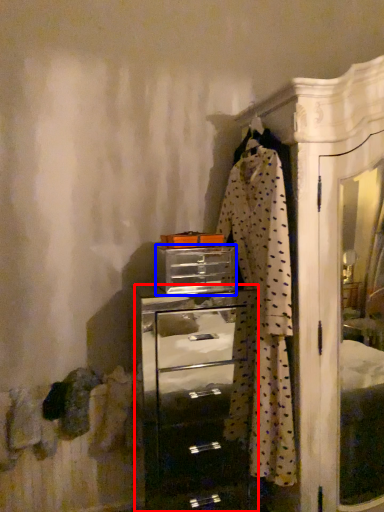
Question: Which of the following is the closest to the observer, chest of drawers (highlighted by a red box) or drawer (highlighted by a blue box)?

Choices:
 (A) chest of drawers
 (B) drawer

Answer: (A)